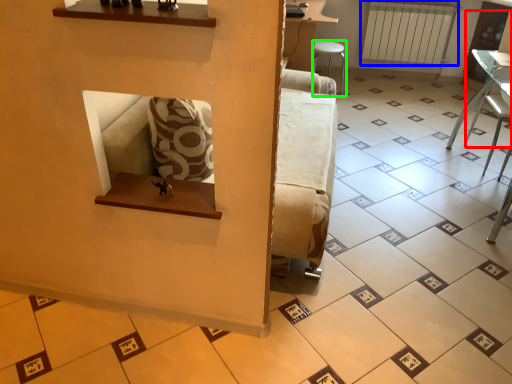
Question: Considering the real-world distances, which object is closest to armchair (highlighted by a red box)? radiator (highlighted by a blue box) or furniture (highlighted by a green box).

Choices:
 (A) radiator
 (B) furniture

Answer: (A)